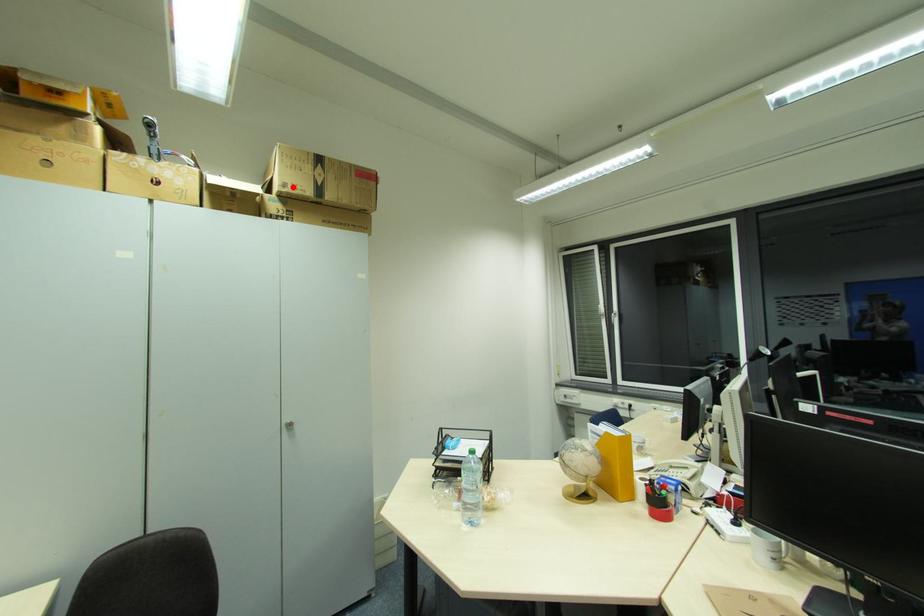
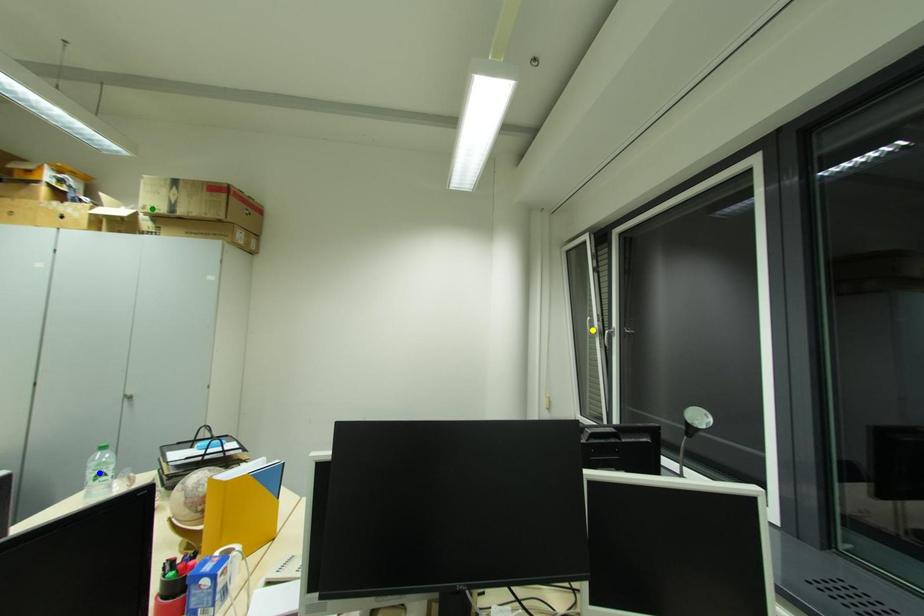
Question: I am providing you with two images of the same scene from different viewpoints. A red point is marked on the first image. You are given multiple points on the second image. Can you choose the point in image 2 that corresponds to the point in image 1?

Choices:
 (A) yellow point
 (B) blue point
 (C) green point

Answer: (C)